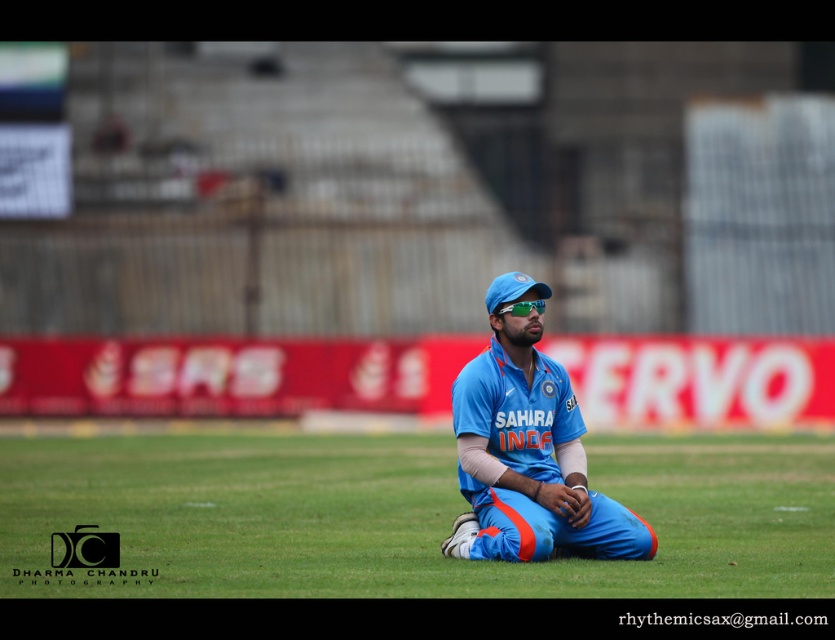
Question: Estimate the real-world distances between objects in this image. Which object is closer to the blue fabric baseball cap at center?

Choices:
 (A) blue fabric uniform at center
 (B) green grass at center

Answer: (A)

Question: Is green grass at center below blue fabric uniform at center?

Choices:
 (A) yes
 (B) no

Answer: (A)

Question: Which object is the closest to the blue fabric baseball cap at center?

Choices:
 (A) green grass at center
 (B) blue fabric uniform at center

Answer: (B)

Question: Is blue fabric uniform at center smaller than blue fabric baseball cap at center?

Choices:
 (A) no
 (B) yes

Answer: (B)

Question: Estimate the real-world distances between objects in this image. Which object is farther from the green grass at center?

Choices:
 (A) blue fabric baseball cap at center
 (B) blue fabric uniform at center

Answer: (A)

Question: Is blue fabric uniform at center thinner than blue fabric baseball cap at center?

Choices:
 (A) no
 (B) yes

Answer: (A)